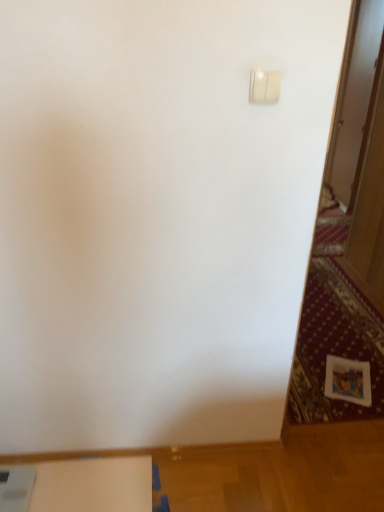
Question: Which is correct: white matte table at lower left is inside white plastic light switch at upper right, or outside of it?

Choices:
 (A) outside
 (B) inside

Answer: (A)

Question: In the image, is white matte table at lower left on the left side or the right side of white plastic light switch at upper right?

Choices:
 (A) left
 (B) right

Answer: (A)

Question: From a real-world perspective, is white matte table at lower left above or below white plastic light switch at upper right?

Choices:
 (A) below
 (B) above

Answer: (A)

Question: In terms of height, does white plastic light switch at upper right look taller or shorter compared to white matte table at lower left?

Choices:
 (A) short
 (B) tall

Answer: (B)

Question: From a real-world perspective, is white plastic light switch at upper right above or below white matte table at lower left?

Choices:
 (A) above
 (B) below

Answer: (A)

Question: Relative to white matte table at lower left, is white plastic light switch at upper right in front or behind?

Choices:
 (A) behind
 (B) front

Answer: (B)

Question: Considering the positions of point (264, 96) and point (99, 494), is point (264, 96) closer or farther from the camera than point (99, 494)?

Choices:
 (A) closer
 (B) farther

Answer: (A)